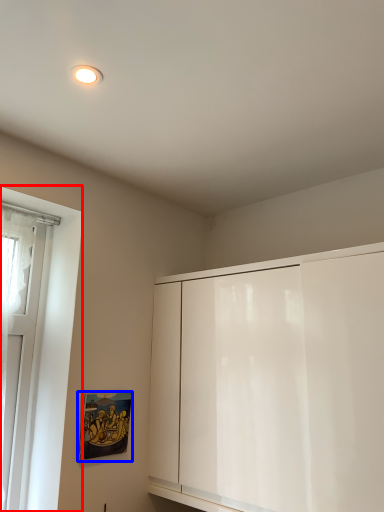
Question: Which object is further to the camera taking this photo, window (highlighted by a red box) or picture frame (highlighted by a blue box)?

Choices:
 (A) window
 (B) picture frame

Answer: (B)